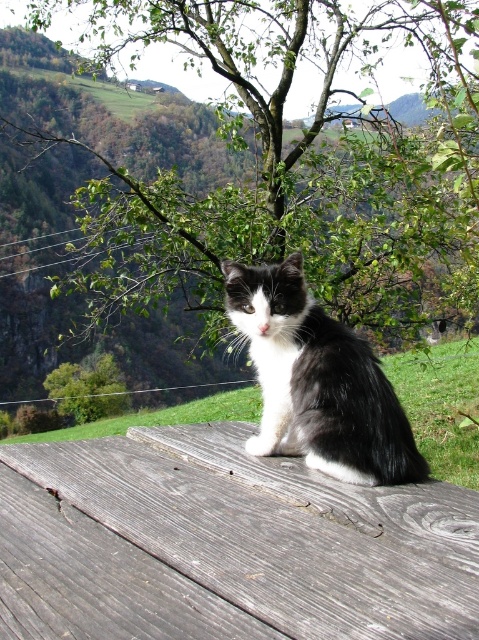
Describe the element at coordinates (225, 545) in the screenshot. I see `wooden plank at center` at that location.

Measure the distance between point (241,556) and camera.

Point (241,556) is 34.90 inches away from camera.

The height and width of the screenshot is (640, 479). I want to click on wooden plank at center, so [225, 545].

Does green leafy tree at upper center appear on the left side of wooden plank at center?

Incorrect, green leafy tree at upper center is not on the left side of wooden plank at center.

This screenshot has width=479, height=640. What do you see at coordinates (291, 164) in the screenshot?
I see `green leafy tree at upper center` at bounding box center [291, 164].

Identify the location of green leafy tree at upper center. This screenshot has height=640, width=479. [x=291, y=164].

Can you confirm if green leafy tree at upper center is positioned above black/white fur cat at center?

Indeed, green leafy tree at upper center is positioned over black/white fur cat at center.

Is green leafy tree at upper center thinner than black/white fur cat at center?

No.

Find the location of `green leafy tree at upper center`. green leafy tree at upper center is located at coordinates (291, 164).

Find the location of `green leafy tree at upper center`. green leafy tree at upper center is located at coordinates (291, 164).